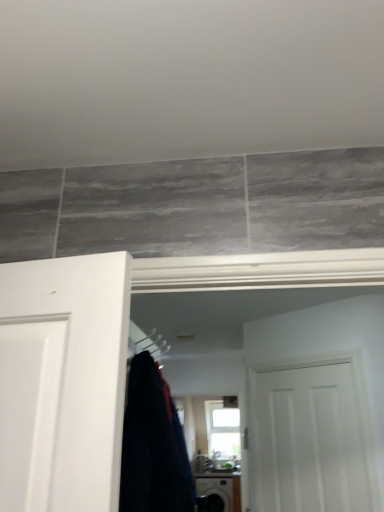
Question: Which direction should I rotate to look at black glossy washing machine at lower center?

Choices:
 (A) right
 (B) left

Answer: (A)

Question: Is black glossy washing machine at lower center taller than dark blue fabric at center?

Choices:
 (A) yes
 (B) no

Answer: (A)

Question: Could dark blue fabric at center be considered to be inside black glossy washing machine at lower center?

Choices:
 (A) no
 (B) yes

Answer: (A)

Question: From the image's perspective, is black glossy washing machine at lower center under dark blue fabric at center?

Choices:
 (A) yes
 (B) no

Answer: (A)

Question: Is black glossy washing machine at lower center at the right side of dark blue fabric at center?

Choices:
 (A) no
 (B) yes

Answer: (B)

Question: Does black glossy washing machine at lower center have a smaller size compared to dark blue fabric at center?

Choices:
 (A) no
 (B) yes

Answer: (A)

Question: Is black glossy washing machine at lower center far from dark blue fabric at center?

Choices:
 (A) no
 (B) yes

Answer: (B)

Question: Considering the relative sizes of clear glass window at center and silver metallic hanger at center in the image provided, is clear glass window at center shorter than silver metallic hanger at center?

Choices:
 (A) yes
 (B) no

Answer: (B)

Question: From the image's perspective, is clear glass window at center located beneath silver metallic hanger at center?

Choices:
 (A) no
 (B) yes

Answer: (B)

Question: Considering the relative sizes of clear glass window at center and silver metallic hanger at center in the image provided, is clear glass window at center bigger than silver metallic hanger at center?

Choices:
 (A) yes
 (B) no

Answer: (A)

Question: From the image's perspective, is clear glass window at center above silver metallic hanger at center?

Choices:
 (A) no
 (B) yes

Answer: (A)

Question: Can you confirm if clear glass window at center is wider than silver metallic hanger at center?

Choices:
 (A) yes
 (B) no

Answer: (A)

Question: Is clear glass window at center smaller than silver metallic hanger at center?

Choices:
 (A) no
 (B) yes

Answer: (A)

Question: Considering the relative positions of black glossy washing machine at lower center and white matte door at center in the image provided, is black glossy washing machine at lower center to the right of white matte door at center from the viewer's perspective?

Choices:
 (A) yes
 (B) no

Answer: (B)